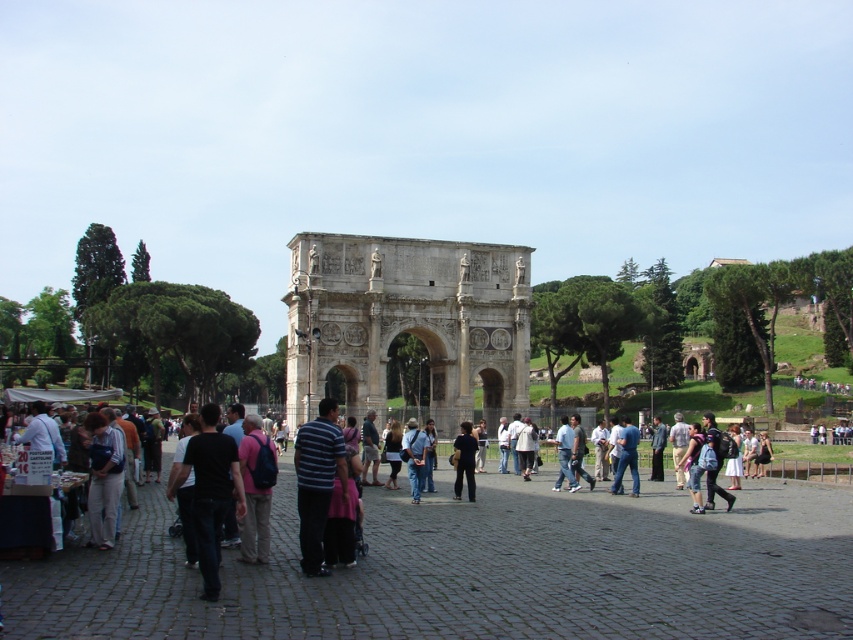
Question: Which point is farther to the camera?

Choices:
 (A) light beige stone arch at center
 (B) blue jeans at center
 (C) dark blue fabric shirt at center

Answer: (A)

Question: Which of the following is the closest to the observer?

Choices:
 (A) light beige stone arch at center
 (B) blue jeans at center
 (C) dark blue fabric shirt at center

Answer: (B)

Question: Is light beige stone arch at center below blue jeans at center?

Choices:
 (A) no
 (B) yes

Answer: (A)

Question: Considering the real-world distances, which object is farthest from the light beige stone arch at center?

Choices:
 (A) blue jeans at center
 (B) dark blue fabric shirt at center

Answer: (B)

Question: Is light beige stone arch at center smaller than dark blue fabric shirt at center?

Choices:
 (A) no
 (B) yes

Answer: (A)

Question: In this image, where is light beige stone arch at center located relative to dark blue fabric shirt at center?

Choices:
 (A) below
 (B) above

Answer: (B)